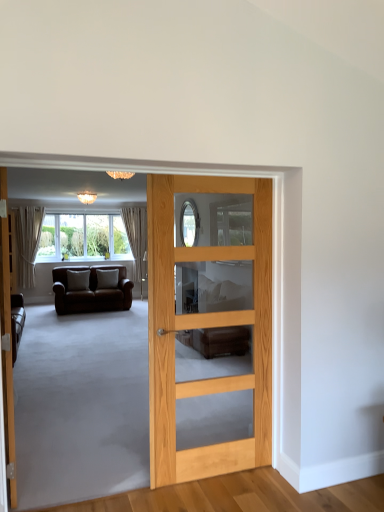
I want to click on spots to the right of natural wood door at center, so click(286, 492).